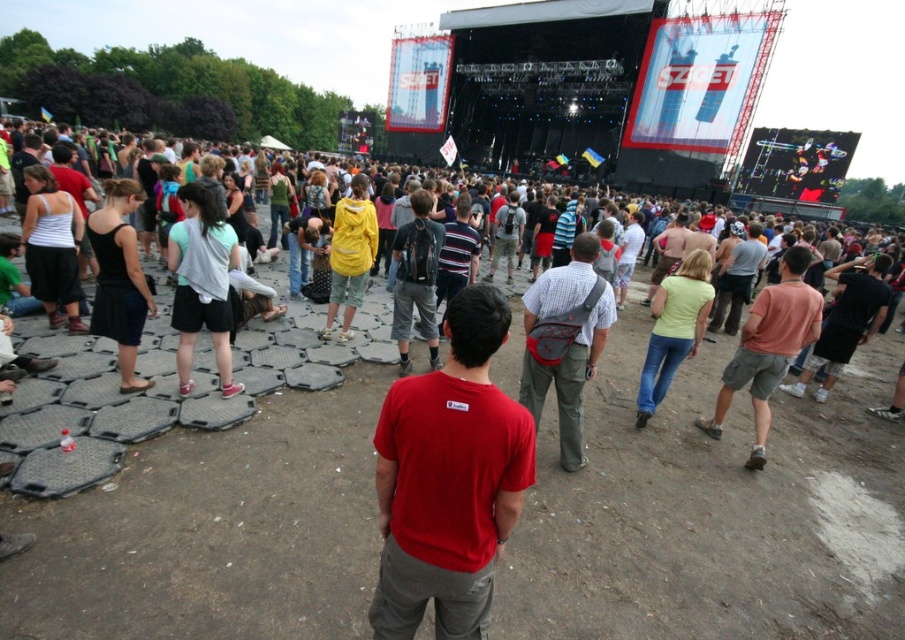
Does red cotton t-shirt at center have a greater width compared to plaid cotton shirt at center?

In fact, red cotton t-shirt at center might be narrower than plaid cotton shirt at center.

Is red cotton t-shirt at center below plaid cotton shirt at center?

Yes, red cotton t-shirt at center is below plaid cotton shirt at center.

Does point (405, 522) come in front of point (535, 321)?

Yes.

Where is `red cotton t-shirt at center`? The height and width of the screenshot is (640, 905). red cotton t-shirt at center is located at coordinates (449, 480).

Is red cotton t-shirt at center smaller than light pink cotton t-shirt at right?

Yes, red cotton t-shirt at center is smaller than light pink cotton t-shirt at right.

Where is `red cotton t-shirt at center`? red cotton t-shirt at center is located at coordinates (449, 480).

At what (x,y) coordinates should I click in order to perform the action: click on red cotton t-shirt at center. Please return your answer as a coordinate pair (x, y). The image size is (905, 640). Looking at the image, I should click on (449, 480).

The image size is (905, 640). I want to click on red cotton t-shirt at center, so coord(449,480).

Between light pink cotton t-shirt at right and dark gray shorts at lower right, which one has more height?

light pink cotton t-shirt at right

You are a GUI agent. You are given a task and a screenshot of the screen. Output one action in this format:
    pyautogui.click(x=<x>, y=<y>)
    Task: Click on the light pink cotton t-shirt at right
    Image resolution: width=905 pixels, height=640 pixels.
    Given the screenshot: What is the action you would take?
    pyautogui.click(x=768, y=348)